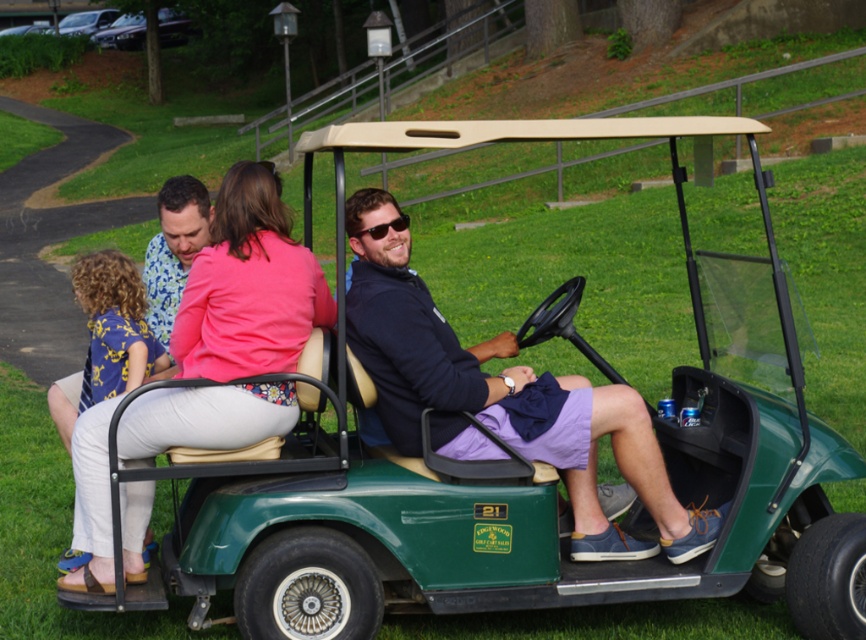
Question: Can you confirm if pink fabric shirt at upper center is wider than blue floral dress at left?

Choices:
 (A) yes
 (B) no

Answer: (A)

Question: Can you confirm if matte green golf cart at center is smaller than blue floral dress at left?

Choices:
 (A) no
 (B) yes

Answer: (A)

Question: Which of these objects is positioned closest to the sunglasses at center?

Choices:
 (A) floral fabric shirt at upper left
 (B) blue floral dress at left

Answer: (A)

Question: Which of the following is the closest to the observer?

Choices:
 (A) tap(509, 346)
 (B) tap(107, 307)
 (C) tap(391, 224)

Answer: (C)

Question: Which object appears closest to the camera in this image?

Choices:
 (A) floral fabric shirt at upper left
 (B) pink fabric shirt at upper center
 (C) matte green golf cart at center
 (D) sunglasses at center

Answer: (B)

Question: Does matte green golf cart at center appear under sunglasses at center?

Choices:
 (A) no
 (B) yes

Answer: (B)